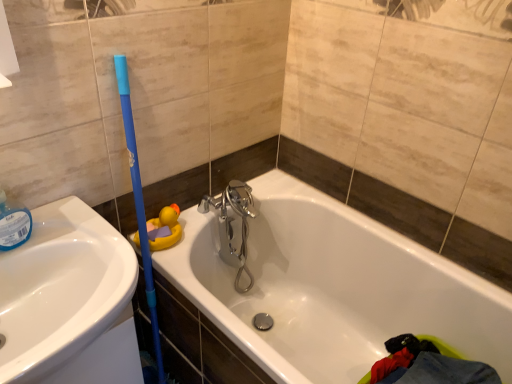
Question: Does white glossy bathtub at center appear on the right side of white glossy sink at left?

Choices:
 (A) no
 (B) yes

Answer: (B)

Question: Considering the relative sizes of white glossy bathtub at center and white glossy sink at left in the image provided, is white glossy bathtub at center bigger than white glossy sink at left?

Choices:
 (A) yes
 (B) no

Answer: (A)

Question: Could you tell me if white glossy bathtub at center is facing white glossy sink at left?

Choices:
 (A) no
 (B) yes

Answer: (B)

Question: From a real-world perspective, is white glossy bathtub at center physically above white glossy sink at left?

Choices:
 (A) no
 (B) yes

Answer: (A)

Question: Is white glossy bathtub at center directly adjacent to white glossy sink at left?

Choices:
 (A) yes
 (B) no

Answer: (B)

Question: From a real-world perspective, is white glossy sink at left above or below yellow rubber duck at upper left?

Choices:
 (A) below
 (B) above

Answer: (A)

Question: Would you say white glossy sink at left is inside or outside yellow rubber duck at upper left?

Choices:
 (A) inside
 (B) outside

Answer: (B)

Question: Considering the positions of white glossy sink at left and yellow rubber duck at upper left in the image, is white glossy sink at left taller or shorter than yellow rubber duck at upper left?

Choices:
 (A) tall
 (B) short

Answer: (A)

Question: Would you say white glossy sink at left is to the left or to the right of yellow rubber duck at upper left in the picture?

Choices:
 (A) left
 (B) right

Answer: (A)

Question: Based on their sizes in the image, would you say white glossy bathtub at center is bigger or smaller than yellow rubber duck at upper left?

Choices:
 (A) big
 (B) small

Answer: (A)

Question: In the image, is white glossy bathtub at center on the left side or the right side of yellow rubber duck at upper left?

Choices:
 (A) left
 (B) right

Answer: (B)

Question: Is point (204, 215) closer or farther from the camera than point (152, 221)?

Choices:
 (A) closer
 (B) farther

Answer: (B)

Question: Considering the positions of white glossy bathtub at center and yellow rubber duck at upper left in the image, is white glossy bathtub at center wider or thinner than yellow rubber duck at upper left?

Choices:
 (A) wide
 (B) thin

Answer: (A)

Question: Which is correct: white glossy bathtub at center is inside white glossy sink at left, or outside of it?

Choices:
 (A) outside
 (B) inside

Answer: (A)

Question: From the image's perspective, is white glossy bathtub at center located above or below white glossy sink at left?

Choices:
 (A) below
 (B) above

Answer: (B)